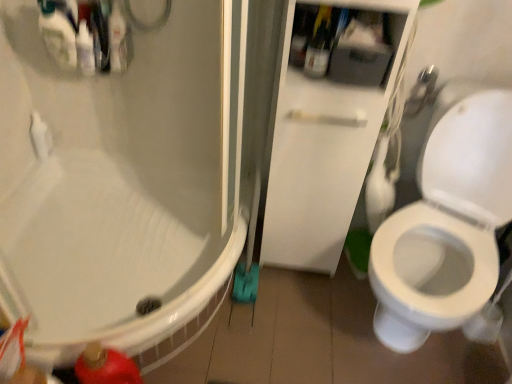
Describe the element at coordinates (329, 122) in the screenshot. I see `white glossy cabinet at center` at that location.

Describe the element at coordinates (105, 262) in the screenshot. The image size is (512, 384). I see `white glossy bathtub at lower left` at that location.

Describe the element at coordinates (319, 44) in the screenshot. I see `translucent plastic bottle at upper center` at that location.

I want to click on brushed metal showerhead at upper right, so click(x=422, y=91).

This screenshot has width=512, height=384. I want to click on white glossy cabinet at center, so click(x=329, y=122).

Is brushed metal showerhead at upper right positioned with its back to white glossy bathtub at lower left?

No, brushed metal showerhead at upper right's orientation is not away from white glossy bathtub at lower left.

Can you confirm if brushed metal showerhead at upper right is thinner than white glossy bathtub at lower left?

Indeed, brushed metal showerhead at upper right has a lesser width compared to white glossy bathtub at lower left.

Which of these two, brushed metal showerhead at upper right or white glossy bathtub at lower left, stands shorter?

brushed metal showerhead at upper right is shorter.

Considering the relative sizes of brushed metal showerhead at upper right and white glossy bathtub at lower left in the image provided, is brushed metal showerhead at upper right bigger than white glossy bathtub at lower left?

No, brushed metal showerhead at upper right is not bigger than white glossy bathtub at lower left.

Who is smaller, translucent plastic bottle at upper center or white glossy bathtub at lower left?

translucent plastic bottle at upper center is smaller.

Which of these two, translucent plastic bottle at upper center or white glossy bathtub at lower left, stands taller?

white glossy bathtub at lower left is taller.

Is translucent plastic bottle at upper center facing towards white glossy bathtub at lower left?

No, translucent plastic bottle at upper center is not turned towards white glossy bathtub at lower left.

Considering the points (385, 106) and (328, 48), which point is behind, point (385, 106) or point (328, 48)?

Point (328, 48)

From the picture: From the image's perspective, between white glossy cabinet at center and translucent plastic bottle at upper center, who is located below?

white glossy cabinet at center is shown below in the image.

Considering the sizes of objects white glossy cabinet at center and translucent plastic bottle at upper center in the image provided, who is taller, white glossy cabinet at center or translucent plastic bottle at upper center?

Standing taller between the two is white glossy cabinet at center.

Considering the relative positions of white glossy cabinet at center and translucent plastic bottle at upper center in the image provided, is white glossy cabinet at center in front of translucent plastic bottle at upper center?

Yes.

Does white glossy bathtub at lower left turn towards translucent plastic bottle at upper center?

No, white glossy bathtub at lower left is not aimed at translucent plastic bottle at upper center.

In terms of width, does white glossy bathtub at lower left look wider or thinner when compared to translucent plastic bottle at upper center?

In the image, white glossy bathtub at lower left appears to be wider than translucent plastic bottle at upper center.

Is white glossy bathtub at lower left outside of translucent plastic bottle at upper center?

Yes, white glossy bathtub at lower left is outside of translucent plastic bottle at upper center.

Which is in front, point (14, 266) or point (311, 40)?

Positioned in front is point (311, 40).

From the image's perspective, between white glossy cabinet at center and white glossy bathtub at lower left, which one is located above?

white glossy cabinet at center appears higher in the image.

Does white glossy cabinet at center have a larger size compared to white glossy bathtub at lower left?

Actually, white glossy cabinet at center might be smaller than white glossy bathtub at lower left.

From the picture: Are white glossy cabinet at center and white glossy bathtub at lower left far apart?

No.

From a real-world perspective, is white glossy cabinet at center positioned over white glossy bathtub at lower left based on gravity?

Correct, in the physical world, white glossy cabinet at center is higher than white glossy bathtub at lower left.

Is the depth of translucent plastic bottle at upper center less than that of translucent plastic bottles at upper left?

Yes, translucent plastic bottle at upper center is closer to the viewer.

From the image's perspective, does translucent plastic bottle at upper center appear lower than translucent plastic bottles at upper left?

Yes, from the image's perspective, translucent plastic bottle at upper center is beneath translucent plastic bottles at upper left.

Can you confirm if translucent plastic bottle at upper center is smaller than translucent plastic bottles at upper left?

Yes.

Can translucent plastic bottles at upper left be found inside white glossy bathtub at lower left?

No, translucent plastic bottles at upper left is not a part of white glossy bathtub at lower left.

Does point (51, 247) lie behind point (91, 67)?

Yes.

Is translucent plastic bottles at upper left at the back of white glossy bathtub at lower left?

white glossy bathtub at lower left is not turned away from translucent plastic bottles at upper left.

Where is `shower above the white glossy bathtub at lower left (from the image's perspective)`? shower above the white glossy bathtub at lower left (from the image's perspective) is located at coordinates (422, 91).

I want to click on bath on the left side of translucent plastic bottle at upper center, so click(105, 262).

Based on their spatial positions, is white glossy bathtub at lower left or translucent plastic bottles at upper left further from white glossy cabinet at center?

Among the two, translucent plastic bottles at upper left is located further to white glossy cabinet at center.

From the image, which object appears to be farther from brushed metal showerhead at upper right, translucent plastic bottles at upper left or translucent plastic bottle at upper center?

Among the two, translucent plastic bottles at upper left is located further to brushed metal showerhead at upper right.

Based on their spatial positions, is brushed metal showerhead at upper right or white glossy bathtub at lower left further from translucent plastic bottles at upper left?

brushed metal showerhead at upper right.

Estimate the real-world distances between objects in this image. Which object is further from white glossy bathtub at lower left, translucent plastic bottle at upper center or translucent plastic bottles at upper left?

Based on the image, translucent plastic bottle at upper center appears to be further to white glossy bathtub at lower left.

Which object lies further to the anchor point white glossy bathtub at lower left, translucent plastic bottle at upper center or brushed metal showerhead at upper right?

The object further to white glossy bathtub at lower left is brushed metal showerhead at upper right.

When comparing their distances from white glossy bathtub at lower left, does translucent plastic bottles at upper left or white glossy cabinet at center seem closer?

white glossy cabinet at center.

Based on their spatial positions, is white glossy bathtub at lower left or brushed metal showerhead at upper right further from white glossy cabinet at center?

The object further to white glossy cabinet at center is white glossy bathtub at lower left.

Which object lies further to the anchor point translucent plastic bottle at upper center, white glossy cabinet at center or translucent plastic bottles at upper left?

translucent plastic bottles at upper left.

Identify the location of bottle between translucent plastic bottles at upper left and white glossy bathtub at lower left in the up-down direction. (319, 44).

The image size is (512, 384). Identify the location of bottle between white glossy bathtub at lower left and white glossy cabinet at center. (319, 44).

You are a GUI agent. You are given a task and a screenshot of the screen. Output one action in this format:
    pyautogui.click(x=<x>, y=<y>)
    Task: Click on the bottle located between translucent plastic bottles at upper left and white glossy cabinet at center in the left-right direction
    
    Given the screenshot: What is the action you would take?
    pyautogui.click(x=319, y=44)

Identify the location of screen door between translucent plastic bottles at upper left and brushed metal showerhead at upper right in the horizontal direction. This screenshot has height=384, width=512. (329, 122).